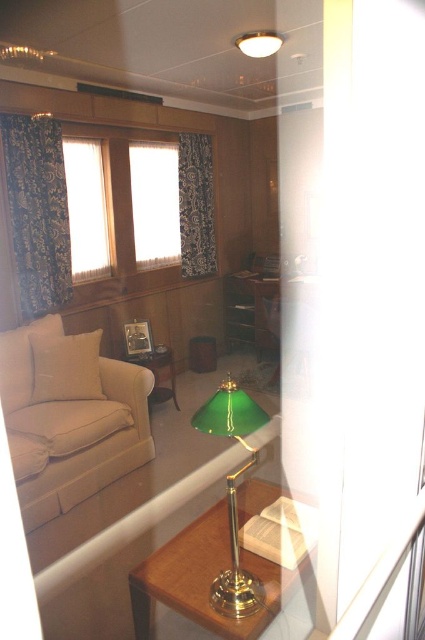
Between gold metallic table at lower right and white lace curtain at upper center, which one is positioned higher?

white lace curtain at upper center is higher up.

Locate an element on the screen. Image resolution: width=425 pixels, height=640 pixels. gold metallic table at lower right is located at coordinates (207, 579).

This screenshot has height=640, width=425. I want to click on gold metallic table at lower right, so click(x=207, y=579).

Is point (198, 268) closer to camera compared to point (269, 44)?

No, it is behind (269, 44).

Can you confirm if dark floral fabric curtain at center is taller than green glass lampshade at upper center?

Yes, dark floral fabric curtain at center is taller than green glass lampshade at upper center.

Find the location of a particular element. Image resolution: width=425 pixels, height=640 pixels. dark floral fabric curtain at center is located at coordinates (195, 205).

What are the coordinates of `dark floral fabric curtain at center` in the screenshot? It's located at (195, 205).

Which is more to the left, green glass lamp at lower center or green glass lampshade at upper center?

From the viewer's perspective, green glass lamp at lower center appears more on the left side.

Is point (232, 433) more distant than point (255, 54)?

No, (232, 433) is in front of (255, 54).

This screenshot has width=425, height=640. What are the coordinates of `green glass lamp at lower center` in the screenshot? It's located at (232, 492).